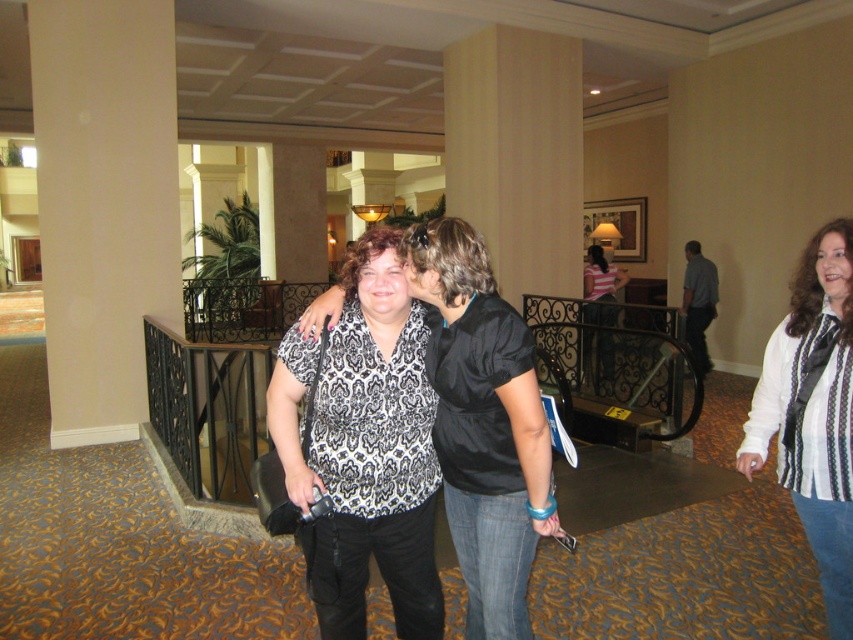
Is point (386, 454) positioned after point (469, 506)?

No, it is not.

Who is more forward, [331,602] or [508,433]?

Point [508,433]

I want to click on black printed blouse at center, so click(364, 449).

Consider the image. Is black and white patterned blouse at center to the left of white striped shirt at center from the viewer's perspective?

Correct, you'll find black and white patterned blouse at center to the left of white striped shirt at center.

Which of these two, black and white patterned blouse at center or white striped shirt at center, stands shorter?

black and white patterned blouse at center is shorter.

What do you see at coordinates (483, 424) in the screenshot? I see `black and white patterned blouse at center` at bounding box center [483, 424].

Find the location of a particular element. black and white patterned blouse at center is located at coordinates point(483,424).

Which is in front, point (369, 532) or point (840, 381)?

Positioned in front is point (369, 532).

Does point (408, 632) come closer to viewer compared to point (776, 397)?

Yes, it is.

Is point (340, 588) closer to camera compared to point (764, 413)?

Yes.

The height and width of the screenshot is (640, 853). Identify the location of black printed blouse at center. (364, 449).